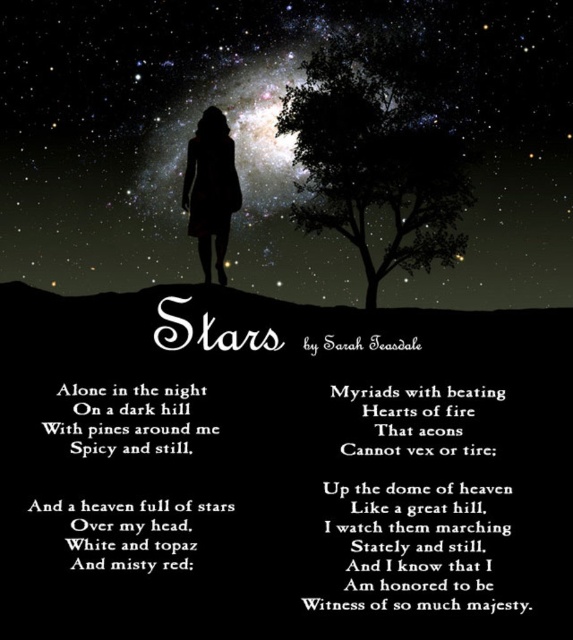
You are an astronomer observing the night sky in the image. You notice the green leafy tree at upper center and the matte black dress at center. Which object is located to the right of the other?

The green leafy tree at upper center is positioned on the right side of matte black dress at center.

Consider the image. You are an astronomer analyzing the night sky in the image. You notice two points of light at coordinates point (x=307, y=208) and point (x=191, y=161). Which point is closer to your observation equipment located at the center of the image?

Point (x=307, y=208) is further to the viewer than point (x=191, y=161). Since the observation equipment is at the center, the closer point would be the one nearer to the center. Calculating the distance from the center to each point, point (x=191, y=161) is closer to the center, so it is closer to the equipment.